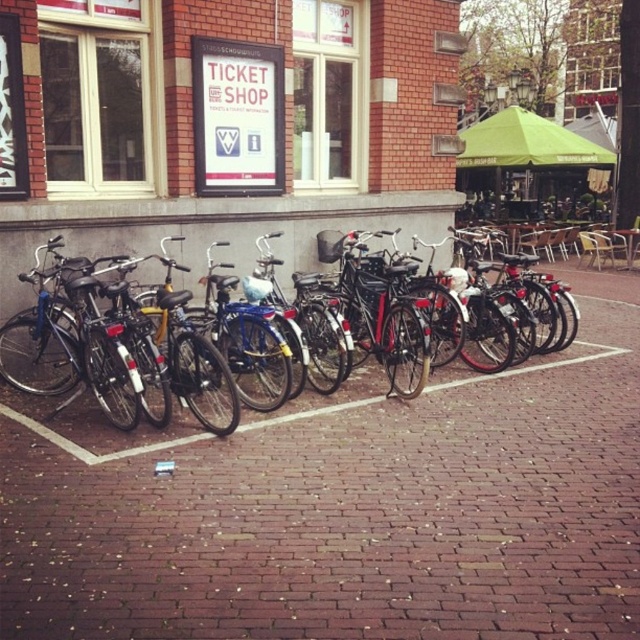
Does brick pavement at center come in front of shiny black bicycle at center?

No, brick pavement at center is further to the viewer.

Which is in front, point (412, 605) or point (28, 372)?

Point (412, 605) is more forward.

Is point (538, 394) positioned before point (410, 314)?

No, it is not.

At what (x,y) coordinates should I click in order to perform the action: click on brick pavement at center. Please return your answer as a coordinate pair (x, y). Looking at the image, I should click on (344, 506).